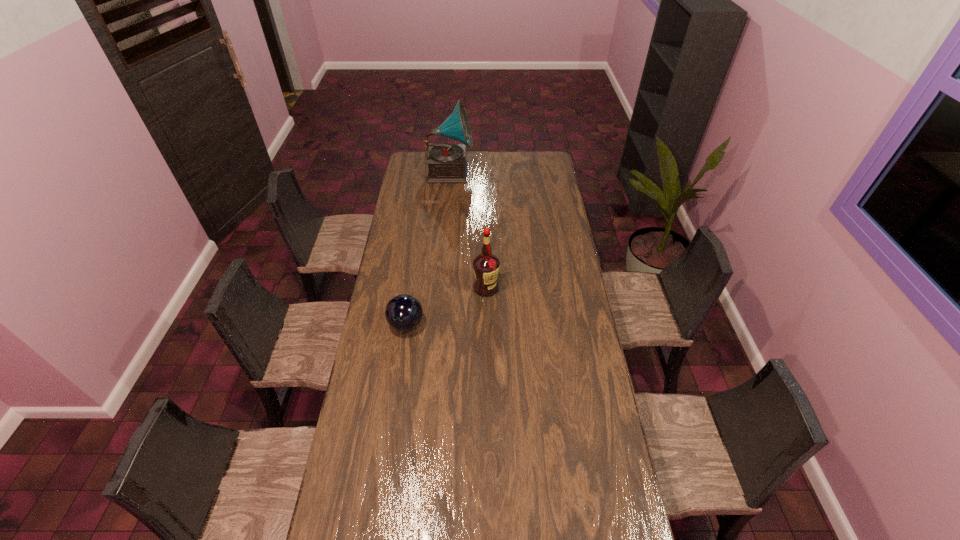
Identify the location of vacant space that's between the bowling ball and the record player. The height and width of the screenshot is (540, 960). (428, 248).

Locate an element on the screen. The height and width of the screenshot is (540, 960). vacant area that lies between the tallest object and the second shortest object is located at coordinates 468,230.

The width and height of the screenshot is (960, 540). I want to click on vacant space that is in between the record player and the nearest object, so click(x=428, y=248).

Image resolution: width=960 pixels, height=540 pixels. I want to click on the second closest object to the farthest object, so click(x=404, y=312).

I want to click on the closest object to the rightmost object, so click(404, 312).

Where is `vacant region that satisfies the following two spatial constraints: 1. on the horn of the record player; 2. on the side of the nearest object with the finger holes`? Image resolution: width=960 pixels, height=540 pixels. vacant region that satisfies the following two spatial constraints: 1. on the horn of the record player; 2. on the side of the nearest object with the finger holes is located at coordinates (436, 325).